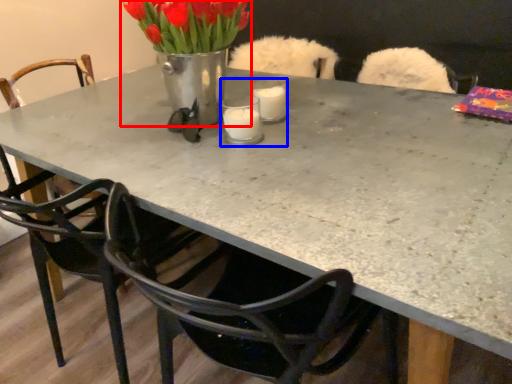
Question: Which of the following is the farthest to the observer, floral arrangement (highlighted by a red box) or candle holder (highlighted by a blue box)?

Choices:
 (A) floral arrangement
 (B) candle holder

Answer: (B)